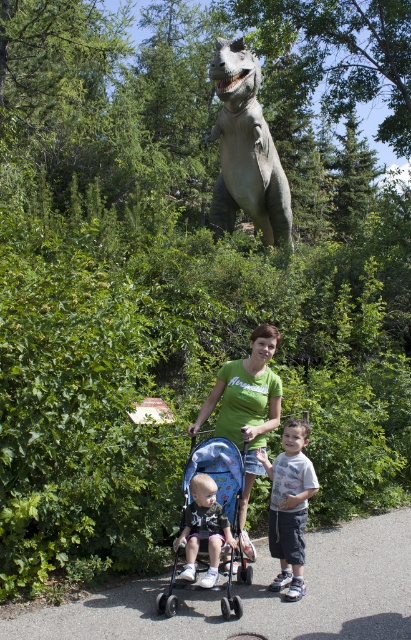
Question: Which object is the farthest from the matte black stroller at center?

Choices:
 (A) green matte shirt at center
 (B) light blue t-shirt at center
 (C) gray textured statue at upper center

Answer: (C)

Question: Is light blue t-shirt at center smaller than matte black stroller at center?

Choices:
 (A) yes
 (B) no

Answer: (B)

Question: Among these objects, which one is farthest from the camera?

Choices:
 (A) gray textured statue at upper center
 (B) blue fabric stroller at center
 (C) green matte shirt at center
 (D) light blue t-shirt at center

Answer: (A)

Question: Observing the image, what is the correct spatial positioning of green matte shirt at center in reference to light blue t-shirt at center?

Choices:
 (A) right
 (B) left

Answer: (B)

Question: From the image, what is the correct spatial relationship of gray textured statue at upper center in relation to light blue t-shirt at center?

Choices:
 (A) left
 (B) right

Answer: (B)

Question: Estimate the real-world distances between objects in this image. Which object is closer to the light blue t-shirt at center?

Choices:
 (A) blue fabric stroller at center
 (B) gray asphalt path at center
 (C) matte black stroller at center
 (D) green matte shirt at center

Answer: (D)